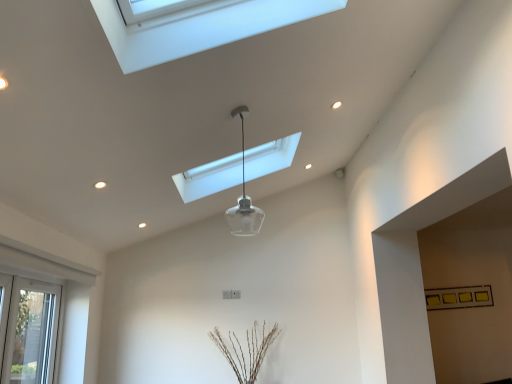
Question: Does transparent glass pendant light at center, the first lamp positioned from the front, have a smaller size compared to transparent glass pendant light at center, acting as the 2th lamp starting from the front?

Choices:
 (A) no
 (B) yes

Answer: (B)

Question: From a real-world perspective, is transparent glass pendant light at center, the first lamp positioned from the front, positioned under transparent glass pendant light at center, the 1th lamp from the back, based on gravity?

Choices:
 (A) yes
 (B) no

Answer: (A)

Question: Would you say transparent glass pendant light at center, the first lamp positioned from the front, is a long distance from transparent glass pendant light at center, acting as the 2th lamp starting from the front?

Choices:
 (A) no
 (B) yes

Answer: (A)

Question: Considering the relative sizes of transparent glass pendant light at center, the first lamp positioned from the front, and transparent glass pendant light at center, acting as the 2th lamp starting from the front, in the image provided, is transparent glass pendant light at center, the first lamp positioned from the front, wider than transparent glass pendant light at center, acting as the 2th lamp starting from the front,?

Choices:
 (A) no
 (B) yes

Answer: (A)

Question: From the image's perspective, is transparent glass pendant light at center, the 2th lamp viewed from the back, on top of transparent glass pendant light at center, the 1th lamp from the back?

Choices:
 (A) no
 (B) yes

Answer: (A)

Question: Considering the relative positions of transparent glass pendant light at center, the 2th lamp viewed from the back, and transparent glass pendant light at center, the 1th lamp from the back, in the image provided, is transparent glass pendant light at center, the 2th lamp viewed from the back, in front of transparent glass pendant light at center, the 1th lamp from the back,?

Choices:
 (A) no
 (B) yes

Answer: (B)

Question: Considering the relative sizes of transparent glass pendant light at center, acting as the 2th lamp starting from the front, and transparent glass pendant light at center, the first lamp positioned from the front, in the image provided, is transparent glass pendant light at center, acting as the 2th lamp starting from the front, taller than transparent glass pendant light at center, the first lamp positioned from the front,?

Choices:
 (A) yes
 (B) no

Answer: (B)

Question: Is transparent glass pendant light at center, the 1th lamp from the back, located outside transparent glass pendant light at center, the 2th lamp viewed from the back?

Choices:
 (A) yes
 (B) no

Answer: (A)

Question: From a real-world perspective, is transparent glass pendant light at center, acting as the 2th lamp starting from the front, physically below transparent glass pendant light at center, the 2th lamp viewed from the back?

Choices:
 (A) no
 (B) yes

Answer: (A)

Question: Could you tell me if transparent glass pendant light at center, acting as the 2th lamp starting from the front, is facing transparent glass pendant light at center, the first lamp positioned from the front?

Choices:
 (A) yes
 (B) no

Answer: (B)

Question: Does transparent glass pendant light at center, the 1th lamp from the back, have a smaller size compared to transparent glass pendant light at center, the first lamp positioned from the front?

Choices:
 (A) yes
 (B) no

Answer: (B)

Question: Considering the relative sizes of transparent glass pendant light at center, the 1th lamp from the back, and transparent glass pendant light at center, the first lamp positioned from the front, in the image provided, is transparent glass pendant light at center, the 1th lamp from the back, bigger than transparent glass pendant light at center, the first lamp positioned from the front,?

Choices:
 (A) no
 (B) yes

Answer: (B)

Question: Is the position of transparent glass pendant light at center, acting as the 2th lamp starting from the front, less distant than that of white plastic window at lower left?

Choices:
 (A) no
 (B) yes

Answer: (A)